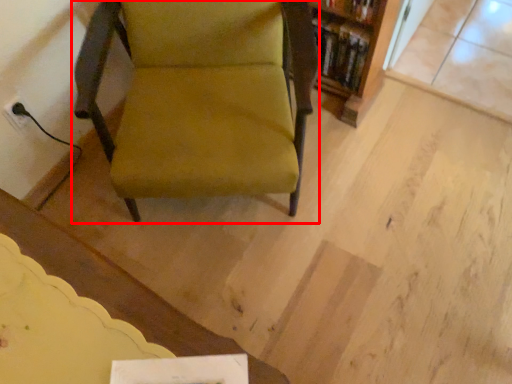
Question: From the image, what is the correct spatial relationship of chair (annotated by the red box) in relation to shelf?

Choices:
 (A) right
 (B) left

Answer: (B)